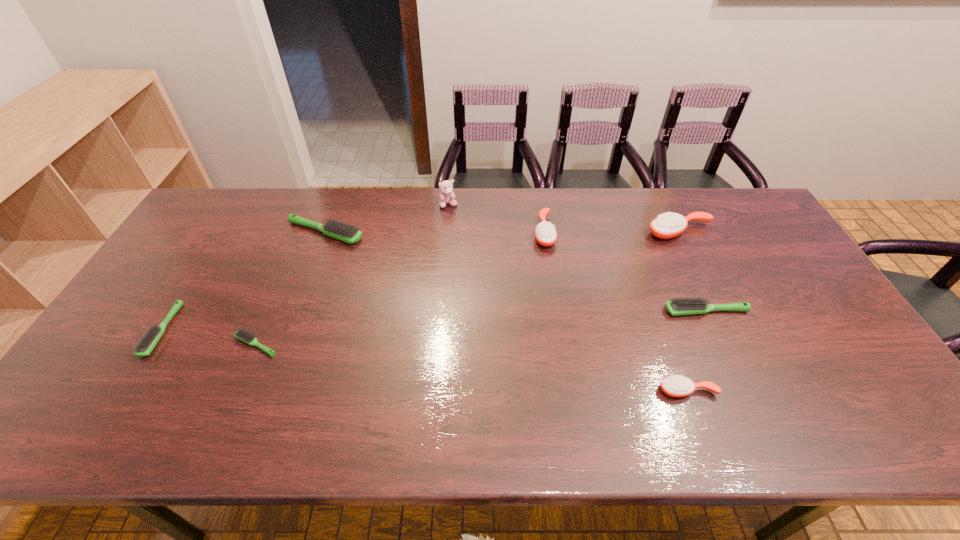
Identify the location of orange hairbrush that is the second closest to the smallest light hairbrush. (675, 386).

The image size is (960, 540). I want to click on the second closest orange hairbrush relative to the sixth tallest hairbrush, so click(x=675, y=386).

This screenshot has width=960, height=540. What are the coordinates of `light hairbrush identified as the closest to the teddy bear` in the screenshot? It's located at (348, 233).

Find the location of a particular element. light hairbrush object that ranks as the third closest to the smallest light hairbrush is located at coordinates [684, 306].

At what (x,y) coordinates should I click in order to perform the action: click on vacant area in the image that satisfies the following two spatial constraints: 1. at the face of the leftmost orange hairbrush; 2. on the left side of the teddy bear. Please return your answer as a coordinate pair (x, y). This screenshot has height=540, width=960. Looking at the image, I should click on (446, 232).

At what (x,y) coordinates should I click in order to perform the action: click on free space that satisfies the following two spatial constraints: 1. at the face of the teddy bear; 2. on the left side of the smallest orange hairbrush. Please return your answer as a coordinate pair (x, y). The image size is (960, 540). Looking at the image, I should click on click(x=433, y=390).

Where is `vacant space that satisfies the following two spatial constraints: 1. on the back side of the fourth hairbrush from right to left; 2. on the left side of the shortest hairbrush`? The height and width of the screenshot is (540, 960). vacant space that satisfies the following two spatial constraints: 1. on the back side of the fourth hairbrush from right to left; 2. on the left side of the shortest hairbrush is located at coordinates (304, 232).

This screenshot has width=960, height=540. I want to click on vacant space that satisfies the following two spatial constraints: 1. at the face of the fourth object from left to right; 2. on the left side of the nearest hairbrush, so click(x=433, y=390).